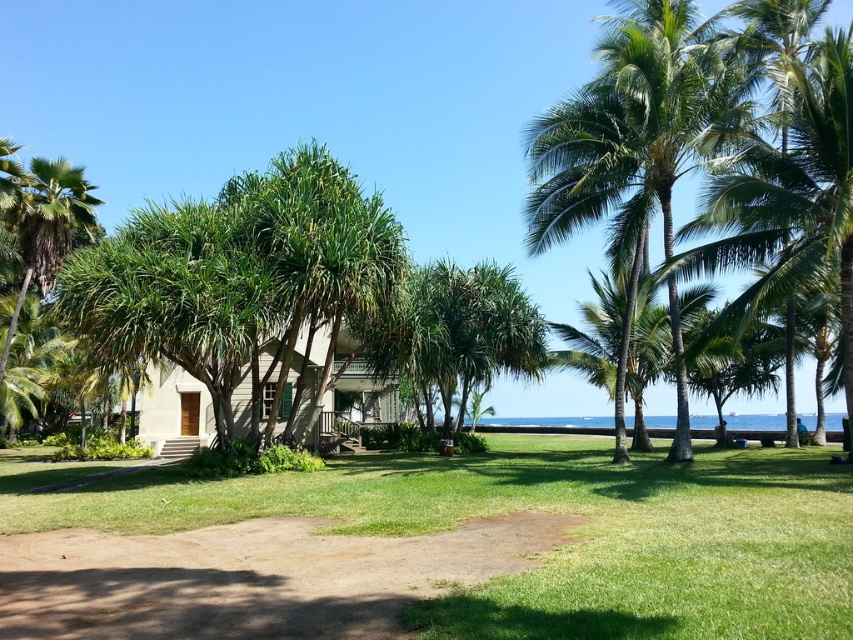
Who is more forward, (299, 522) or (650, 317)?

Positioned in front is point (299, 522).

Does brown dirt path at lower center appear on the right side of green leafy palm tree at center?

Incorrect, brown dirt path at lower center is not on the right side of green leafy palm tree at center.

In the scene shown: Who is more forward, (508, 564) or (625, 384)?

Point (508, 564) is more forward.

Where is `brown dirt path at lower center`? The height and width of the screenshot is (640, 853). brown dirt path at lower center is located at coordinates (251, 577).

Is green leafy palm tree at upper right below beige wooden hut at center?

No.

Who is more forward, (552,232) or (325,340)?

Point (552,232) is in front.

Does point (633, 220) lie behind point (381, 392)?

No.

The image size is (853, 640). In order to click on green leafy palm tree at upper right in this screenshot , I will do `click(631, 140)`.

Does green leafy palm tree at upper right have a lesser height compared to green leafy palm tree at center?

In fact, green leafy palm tree at upper right may be taller than green leafy palm tree at center.

This screenshot has height=640, width=853. What do you see at coordinates (631, 140) in the screenshot?
I see `green leafy palm tree at upper right` at bounding box center [631, 140].

Is point (631, 125) closer to viewer compared to point (648, 349)?

Yes, point (631, 125) is in front of point (648, 349).

Find the location of a particular element. This screenshot has width=853, height=640. green leafy palm tree at upper right is located at coordinates (631, 140).